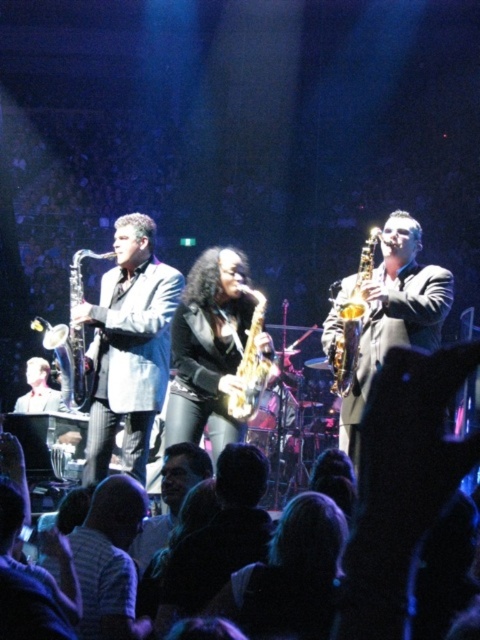
In the scene shown: You are a photographer in the audience. You want to take a photo of the matte gray suit at left and the gold shiny saxophone at right. Based on their positions, which one will appear closer to the bottom of the photo?

The matte gray suit at left is below the gold shiny saxophone at right, so it will appear closer to the bottom of the photo.